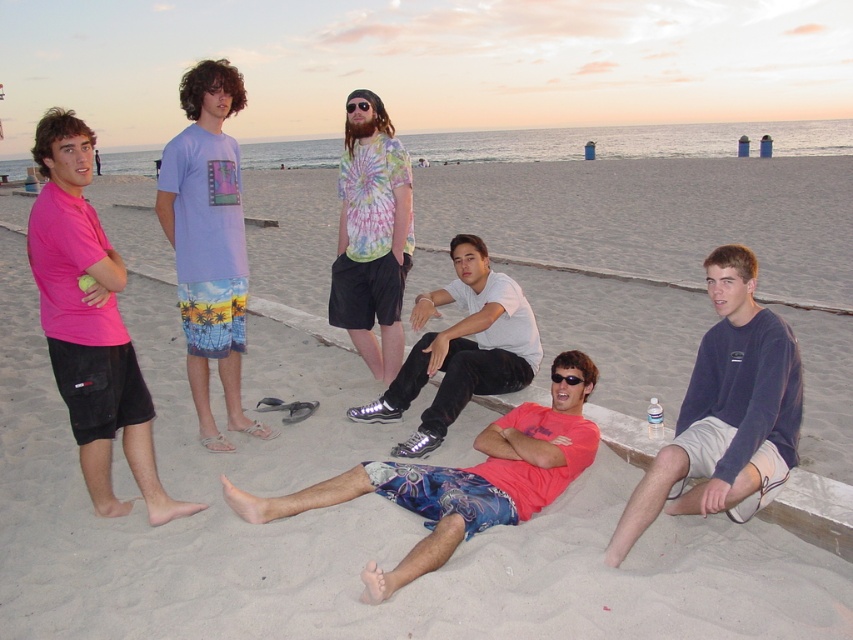
Question: Which object is the farthest from the pink matte shorts at left?

Choices:
 (A) white matte shirt at center
 (B) floral shorts at center
 (C) black reflective sunglasses at center
 (D) tie-dye fabric shirt at center

Answer: (C)

Question: Considering the real-world distances, which object is closest to the tie-dye fabric shirt at center?

Choices:
 (A) white matte shirt at center
 (B) pink matte shorts at left

Answer: (A)

Question: Observing the image, what is the correct spatial positioning of tie-dye fabric shirt at center in reference to translucent plastic goggles at center?

Choices:
 (A) right
 (B) left

Answer: (A)

Question: Which object is farther from the camera taking this photo?

Choices:
 (A) black reflective sunglasses at center
 (B) floral shorts at center
 (C) tie-dye fabric shirt at center
 (D) translucent plastic goggles at center

Answer: (D)

Question: Can you confirm if dark blue sweatshirt at center is positioned to the left of floral shorts at center?

Choices:
 (A) yes
 (B) no

Answer: (B)

Question: Does purple tie-dye t-shirt at center have a lesser width compared to translucent plastic goggles at center?

Choices:
 (A) yes
 (B) no

Answer: (B)